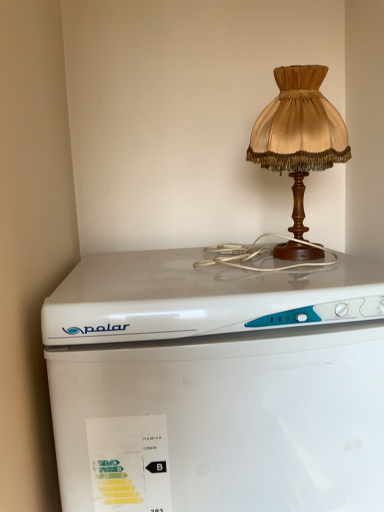
Measure the distance between point (294, 272) and camera.

Point (294, 272) is 29.29 inches from camera.

What do you see at coordinates (217, 384) in the screenshot?
I see `white plastic refrigerator at center` at bounding box center [217, 384].

I want to click on white plastic refrigerator at center, so click(217, 384).

Describe the element at coordinates (299, 133) in the screenshot. This screenshot has width=384, height=512. I see `satin gold lampshade at upper right` at that location.

Identify the location of satin gold lampshade at upper right. (299, 133).

Locate an element on the screen. The height and width of the screenshot is (512, 384). white plastic refrigerator at center is located at coordinates (217, 384).

Does white plastic refrigerator at center appear on the left side of satin gold lampshade at upper right?

Indeed, white plastic refrigerator at center is positioned on the left side of satin gold lampshade at upper right.

Which object is further away from the camera, white plastic refrigerator at center or satin gold lampshade at upper right?

Positioned behind is satin gold lampshade at upper right.

Considering the points (263, 413) and (329, 134), which point is in front, point (263, 413) or point (329, 134)?

The point (263, 413) is more forward.

From the image's perspective, is white plastic refrigerator at center above or below satin gold lampshade at upper right?

white plastic refrigerator at center is situated lower than satin gold lampshade at upper right in the image.

From a real-world perspective, between white plastic refrigerator at center and satin gold lampshade at upper right, who is vertically lower?

In real-world perspective, white plastic refrigerator at center is lower.

Considering the sizes of objects white plastic refrigerator at center and satin gold lampshade at upper right in the image provided, who is wider, white plastic refrigerator at center or satin gold lampshade at upper right?

Wider between the two is white plastic refrigerator at center.

Is white plastic refrigerator at center taller than satin gold lampshade at upper right?

Indeed, white plastic refrigerator at center has a greater height compared to satin gold lampshade at upper right.

Who is smaller, white plastic refrigerator at center or satin gold lampshade at upper right?

Smaller between the two is satin gold lampshade at upper right.

Is white plastic refrigerator at center outside of satin gold lampshade at upper right?

Yes, white plastic refrigerator at center is located beyond the bounds of satin gold lampshade at upper right.

Is there a large distance between white plastic refrigerator at center and satin gold lampshade at upper right?

No, white plastic refrigerator at center is in close proximity to satin gold lampshade at upper right.

Could you tell me if white plastic refrigerator at center is facing satin gold lampshade at upper right?

No, white plastic refrigerator at center does not turn towards satin gold lampshade at upper right.

How distant is white plastic refrigerator at center from satin gold lampshade at upper right?

white plastic refrigerator at center and satin gold lampshade at upper right are 12.62 inches apart.

Where is `lamp behind the white plastic refrigerator at center`? Image resolution: width=384 pixels, height=512 pixels. lamp behind the white plastic refrigerator at center is located at coordinates (299, 133).

Considering the relative positions of satin gold lampshade at upper right and white plastic refrigerator at center in the image provided, is satin gold lampshade at upper right to the left or to the right of white plastic refrigerator at center?

satin gold lampshade at upper right is positioned on white plastic refrigerator at center's right side.

Considering the positions of objects satin gold lampshade at upper right and white plastic refrigerator at center in the image provided, who is behind, satin gold lampshade at upper right or white plastic refrigerator at center?

satin gold lampshade at upper right is further from the camera.

Considering the points (269, 145) and (360, 487), which point is behind, point (269, 145) or point (360, 487)?

The point (269, 145) is farther.

From the image's perspective, which one is positioned lower, satin gold lampshade at upper right or white plastic refrigerator at center?

From the image's view, white plastic refrigerator at center is below.

From a real-world perspective, between satin gold lampshade at upper right and white plastic refrigerator at center, who is vertically lower?

In real-world perspective, white plastic refrigerator at center is lower.

Can you confirm if satin gold lampshade at upper right is wider than white plastic refrigerator at center?

No.

Consider the image. Considering the relative sizes of satin gold lampshade at upper right and white plastic refrigerator at center in the image provided, is satin gold lampshade at upper right shorter than white plastic refrigerator at center?

Indeed, satin gold lampshade at upper right has a lesser height compared to white plastic refrigerator at center.

Is satin gold lampshade at upper right smaller than white plastic refrigerator at center?

Yes.

Does satin gold lampshade at upper right contain white plastic refrigerator at center?

That's incorrect, white plastic refrigerator at center is not inside satin gold lampshade at upper right.

Is the surface of satin gold lampshade at upper right in direct contact with white plastic refrigerator at center?

satin gold lampshade at upper right is not next to white plastic refrigerator at center, and they're not touching.

Is satin gold lampshade at upper right facing towards white plastic refrigerator at center?

No, satin gold lampshade at upper right is not aimed at white plastic refrigerator at center.

What's the angular difference between satin gold lampshade at upper right and white plastic refrigerator at center's facing directions?

0.00254 degrees separate the facing orientations of satin gold lampshade at upper right and white plastic refrigerator at center.

The image size is (384, 512). What are the coordinates of `lamp behind the white plastic refrigerator at center` in the screenshot? It's located at (299, 133).

The width and height of the screenshot is (384, 512). In order to click on lamp on the right of white plastic refrigerator at center in this screenshot , I will do `click(299, 133)`.

Image resolution: width=384 pixels, height=512 pixels. I want to click on lamp located above the white plastic refrigerator at center (from the image's perspective), so click(299, 133).